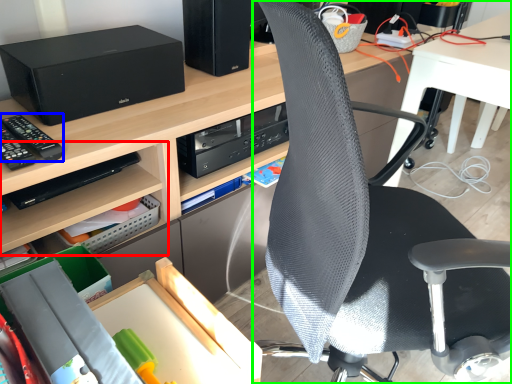
Question: Considering the real-world distances, which object is closest to shelf (highlighted by a red box)? equipment (highlighted by a blue box) or chair (highlighted by a green box).

Choices:
 (A) equipment
 (B) chair

Answer: (A)